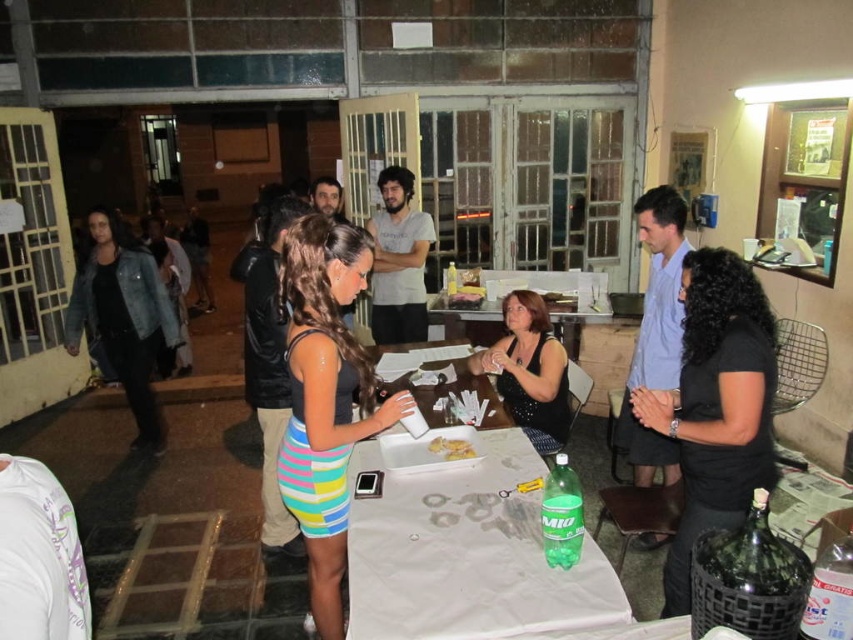
You are a photographer at a party. You want to take a photo of the multicolored striped dress at center from a distance that allows you to capture the entire dress without cropping any part of it. The camera you are using has a maximum focal length of 50mm and a sensor size of 24x36mm. Assuming the dress is 2 meters tall, what is the minimum distance you should stand from the dress to ensure it fits entirely within the frame?

The multicolored striped dress at center and camera are 6.91 feet apart. Since the dress is 2 meters tall and the camera sensor height is 24mm, using the formula distance > height of object multiplied by sensor dimension divided by focal length, the minimum distance required is approximately 2m multiplied by 24mm divided by 50mm equals 0.96 meters. However, since the existing distance is 6.91 feet which is about 2.11 meters, which is greater than 0.96 meters, the photographer can stand at the current 6.91fe

You are at a party and want to take a photo of the yellow crumbly cake at center. You have a denim jacket at left that you might need to move. Considering their sizes, which item would require more space to store if you decide to move them both?

The denim jacket at left has a larger size compared to the yellow crumbly cake at center, so it would require more space to store.

You are standing at the center of the room and want to pick up an item from the table. There are two points marked on the table where items are placed. Which point is closer to you, point (733, 371) or point (503, 387)?

Point (733, 371) is closer to the camera than point (503, 387), so it is closer to you.